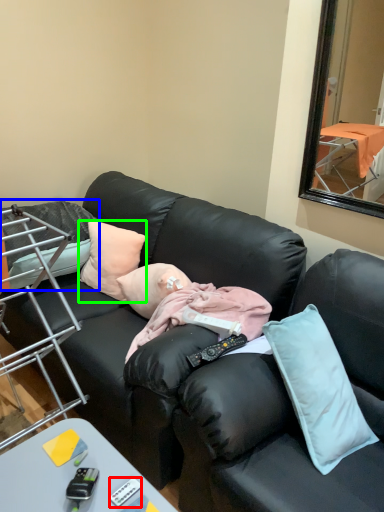
Question: Which object is the farthest from remote control (highlighted by a red box)? Choose among these: pillow (highlighted by a blue box) or pillow (highlighted by a green box).

Choices:
 (A) pillow
 (B) pillow

Answer: (A)